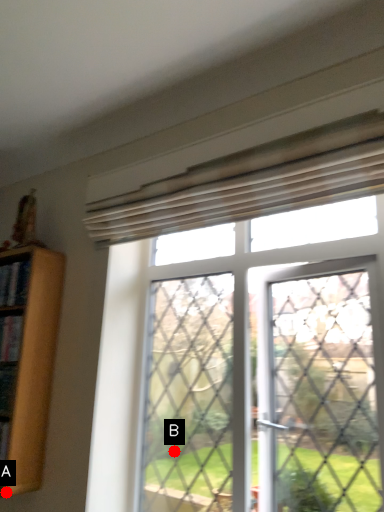
Question: Two points are circled on the image, labeled by A and B beside each circle. Among these points, which one is farthest from the camera?

Choices:
 (A) A is further
 (B) B is further

Answer: (B)